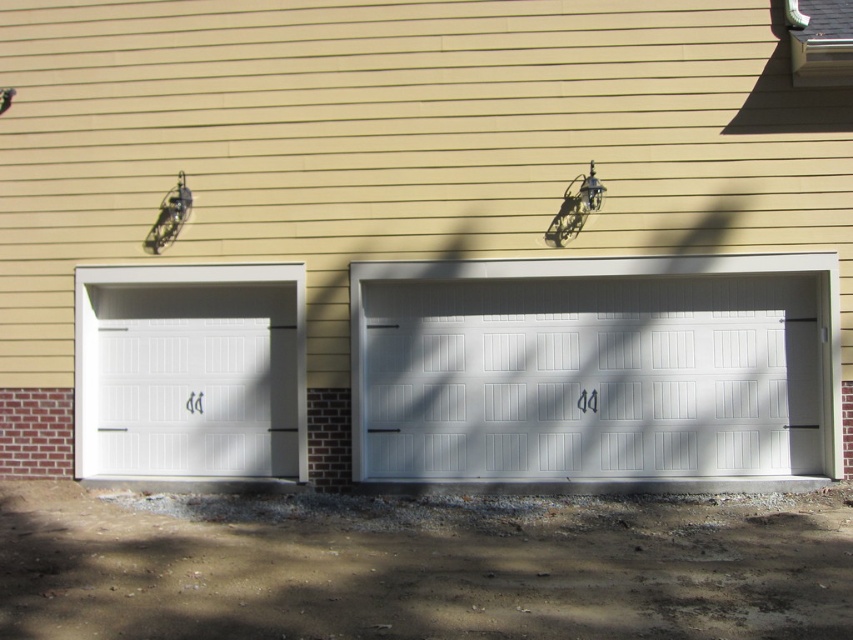
Question: Observing the image, what is the correct spatial positioning of dirt at lower center in reference to white painted wood garage door at left?

Choices:
 (A) right
 (B) left

Answer: (A)

Question: Can you confirm if white painted wood garage door at center is positioned above white painted wood garage door at left?

Choices:
 (A) yes
 (B) no

Answer: (B)

Question: Can you confirm if dirt at lower center is positioned to the right of white painted wood garage door at left?

Choices:
 (A) yes
 (B) no

Answer: (A)

Question: Which point is closer to the camera?

Choices:
 (A) dirt at lower center
 (B) white painted wood garage door at left
 (C) white painted wood garage door at center

Answer: (A)

Question: Which object appears closest to the camera in this image?

Choices:
 (A) dirt at lower center
 (B) white painted wood garage door at left
 (C) white painted wood garage door at center

Answer: (A)

Question: Which point is farther to the camera?

Choices:
 (A) white painted wood garage door at left
 (B) white painted wood garage door at center
 (C) dirt at lower center

Answer: (A)